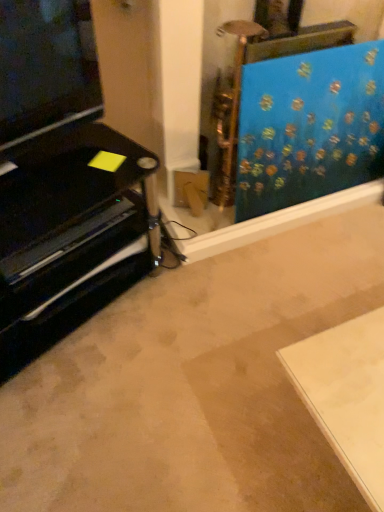
Where is `blank space situated above black glossy entertainment unit at left (from a real-world perspective)`? blank space situated above black glossy entertainment unit at left (from a real-world perspective) is located at coordinates (52, 179).